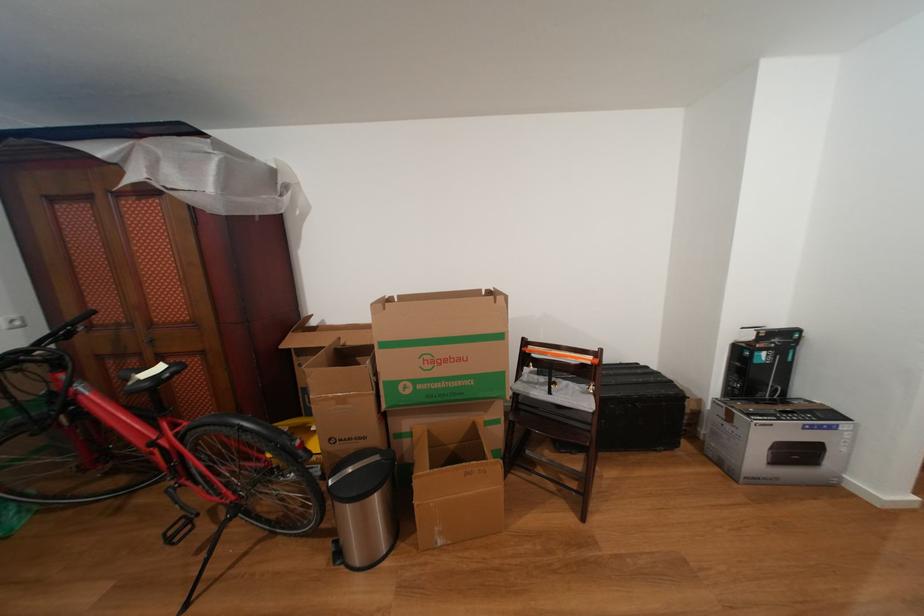
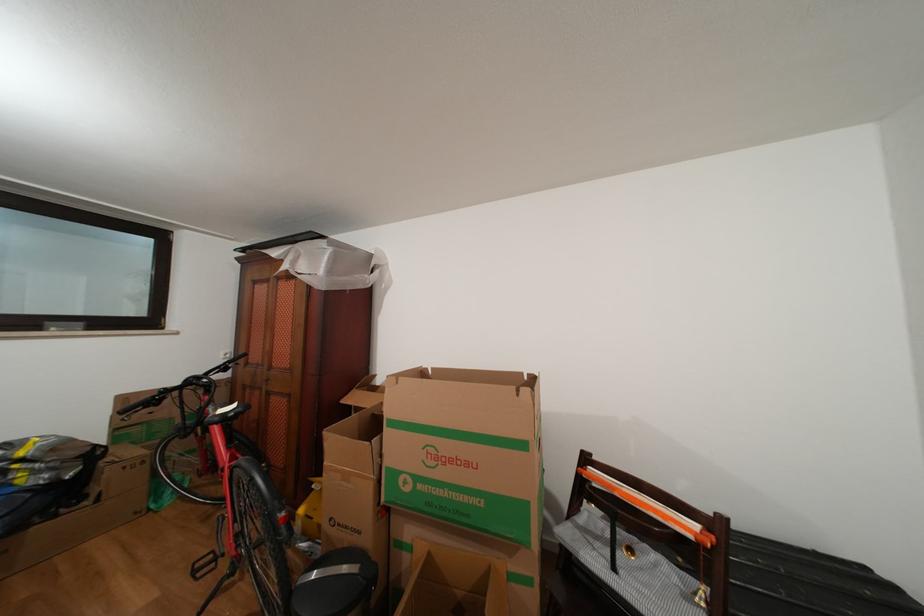
Find the pixel in the second image that matches point 505,427 in the first image.

(537, 586)